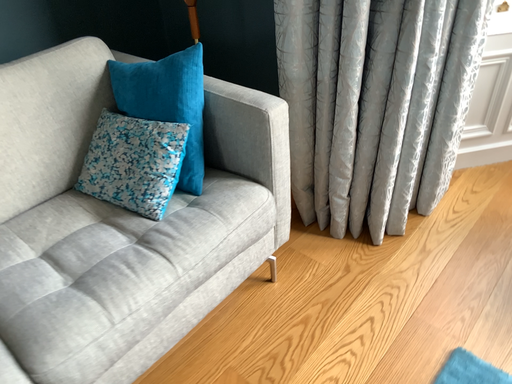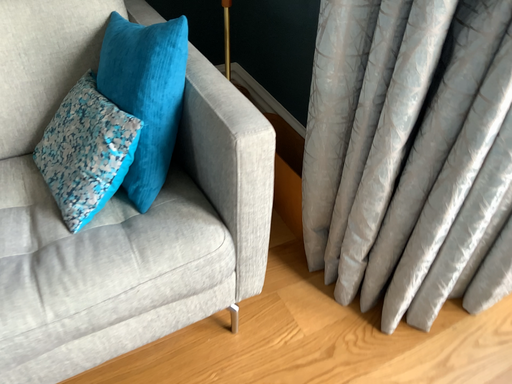
Question: Which way did the camera rotate in the video?

Choices:
 (A) rotated right
 (B) rotated left

Answer: (B)